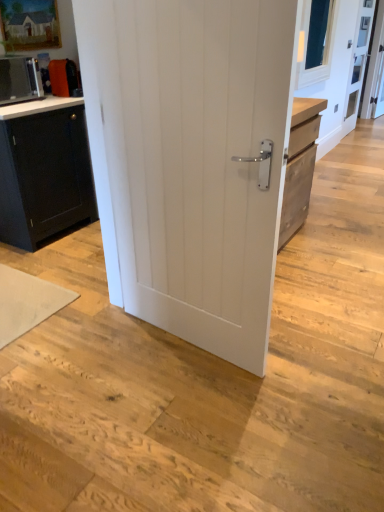
In order to face white matte yoga mat at lower left, should I rotate leftwards or rightwards?

Turn left approximately 24.512 degrees to face it.

In order to click on clear glass screen door at upper right in this screenshot , I will do `click(358, 63)`.

Where is `matte black cabinet at left`? matte black cabinet at left is located at coordinates (45, 175).

This screenshot has height=512, width=384. Identify the location of white glossy countertop at upper left. tap(38, 106).

The width and height of the screenshot is (384, 512). Identify the location of clear glass window screen at upper right. (316, 41).

Measure the distance from matte black microwave at left to clear glass screen door at upper right.

4.46 meters.

Is clear glass screen door at upper right a part of matte black microwave at left?

Actually, clear glass screen door at upper right is outside matte black microwave at left.

Can you confirm if matte black microwave at left is wider than clear glass screen door at upper right?

Yes.

Does matte black microwave at left have a larger size compared to clear glass screen door at upper right?

Actually, matte black microwave at left might be smaller than clear glass screen door at upper right.

Does white painted wood door at center have a greater width compared to white matte yoga mat at lower left?

In fact, white painted wood door at center might be narrower than white matte yoga mat at lower left.

Is point (131, 165) positioned in front of point (31, 285)?

Yes, point (131, 165) is closer to viewer.

From a real-world perspective, between white painted wood door at center and white matte yoga mat at lower left, who is vertically lower?

From a 3D spatial view, white matte yoga mat at lower left is below.

Between matte black cabinet at left and clear glass screen door at upper right, which one is positioned behind?

Positioned behind is clear glass screen door at upper right.

Based on the photo, between matte black cabinet at left and clear glass screen door at upper right, which one appears on the right side from the viewer's perspective?

clear glass screen door at upper right.

Is matte black cabinet at left wider or thinner than clear glass screen door at upper right?

Clearly, matte black cabinet at left has more width compared to clear glass screen door at upper right.

Could you tell me if clear glass window screen at upper right is turned towards white matte yoga mat at lower left?

No, clear glass window screen at upper right does not turn towards white matte yoga mat at lower left.

Identify the location of yoga mat in front of the clear glass window screen at upper right. (27, 302).

Is clear glass window screen at upper right beside white matte yoga mat at lower left?

No, clear glass window screen at upper right is not beside white matte yoga mat at lower left.

Can you tell me how much clear glass window screen at upper right and white matte yoga mat at lower left differ in facing direction?

clear glass window screen at upper right and white matte yoga mat at lower left are facing 0.66 degrees away from each other.

Which point is more distant from viewer, (70,139) or (179,49)?

The point (70,139) is farther from the camera.

From the image's perspective, does matte black cabinet at left appear higher than white painted wood door at center?

Yes, from the image's perspective, matte black cabinet at left is above white painted wood door at center.

From a real-world perspective, is matte black cabinet at left physically located above or below white painted wood door at center?

matte black cabinet at left is situated lower than white painted wood door at center in the real world.

Visually, is matte black cabinet at left positioned to the left or to the right of white painted wood door at center?

matte black cabinet at left is positioned on white painted wood door at center's left side.

Between clear glass screen door at upper right and matte black cabinet at left, which one has more height?

Standing taller between the two is clear glass screen door at upper right.

Is clear glass screen door at upper right surrounding matte black cabinet at left?

No, clear glass screen door at upper right does not contain matte black cabinet at left.

Can you see clear glass screen door at upper right touching matte black cabinet at left?

clear glass screen door at upper right and matte black cabinet at left are not in contact.

Is clear glass screen door at upper right to the left of matte black cabinet at left from the viewer's perspective?

No, clear glass screen door at upper right is not to the left of matte black cabinet at left.

Can you confirm if clear glass window screen at upper right is thinner than white painted wood door at center?

Yes.

From the image's perspective, is clear glass window screen at upper right located above or below white painted wood door at center?

Clearly, from the image's perspective, clear glass window screen at upper right is above white painted wood door at center.

Between clear glass window screen at upper right and white painted wood door at center, which one appears on the right side from the viewer's perspective?

Positioned to the right is clear glass window screen at upper right.

Where is `home appliance located below the clear glass screen door at upper right (from the image's perspective)`? home appliance located below the clear glass screen door at upper right (from the image's perspective) is located at coordinates (19, 80).

Locate an element on the screen. This screenshot has width=384, height=512. door on the right of white matte yoga mat at lower left is located at coordinates (190, 160).

Considering their positions, is clear glass screen door at upper right positioned closer to white painted wood door at center than white glossy countertop at upper left?

white glossy countertop at upper left is positioned closer to the anchor white painted wood door at center.

Considering their positions, is white painted wood door at center positioned further to matte black microwave at left than white matte yoga mat at lower left?

white painted wood door at center is positioned further to the anchor matte black microwave at left.

When comparing their distances from white glossy countertop at upper left, does matte black cabinet at left or clear glass screen door at upper right seem further?

clear glass screen door at upper right.

Considering their positions, is white painted wood door at center positioned closer to white matte yoga mat at lower left than white glossy countertop at upper left?

white painted wood door at center.

Based on their spatial positions, is white painted wood door at center or white glossy countertop at upper left closer to clear glass screen door at upper right?

white glossy countertop at upper left is closer to clear glass screen door at upper right.

Considering their positions, is white matte yoga mat at lower left positioned closer to white glossy countertop at upper left than matte black microwave at left?

Result: matte black microwave at left lies closer to white glossy countertop at upper left than the other object.

From the image, which object appears to be farther from white matte yoga mat at lower left, clear glass window screen at upper right or white painted wood door at center?

clear glass window screen at upper right is positioned further to the anchor white matte yoga mat at lower left.

Looking at the image, which one is located closer to white painted wood door at center, matte black cabinet at left or white glossy countertop at upper left?

The object closer to white painted wood door at center is matte black cabinet at left.

At what (x,y) coordinates should I click in order to perform the action: click on counter top positioned between white painted wood door at center and matte black microwave at left from near to far. Please return your answer as a coordinate pair (x, y). Looking at the image, I should click on (38, 106).

This screenshot has width=384, height=512. I want to click on cabinetry between white glossy countertop at upper left and white matte yoga mat at lower left in the up-down direction, so click(45, 175).

Identify the location of door situated between white glossy countertop at upper left and clear glass window screen at upper right from left to right. The image size is (384, 512). (190, 160).

Locate an element on the screen. This screenshot has height=512, width=384. cabinetry between white glossy countertop at upper left and clear glass window screen at upper right from left to right is located at coordinates (45, 175).